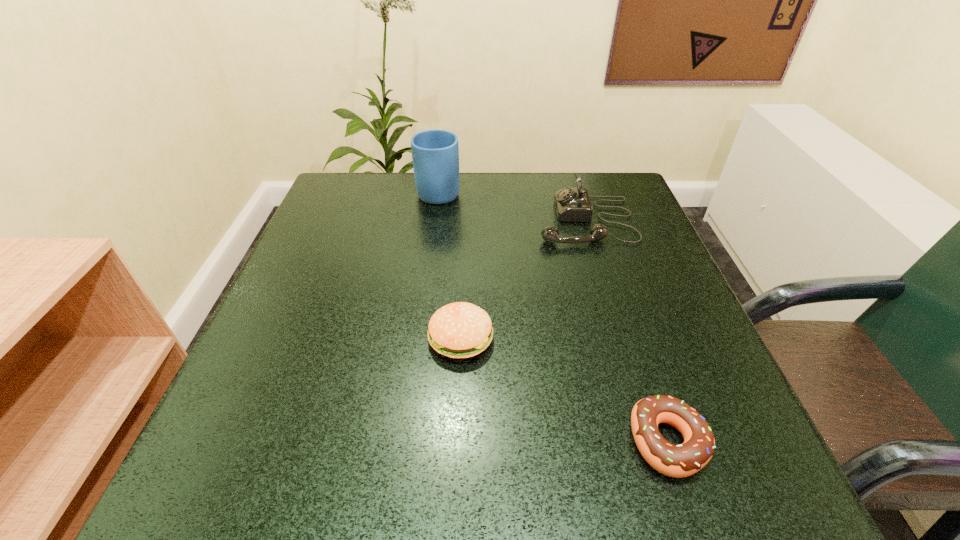
Find the location of a particular element. The height and width of the screenshot is (540, 960). blank region between the third farthest object and the telephone is located at coordinates (523, 280).

Where is `free space between the patty and the shortest object`? The height and width of the screenshot is (540, 960). free space between the patty and the shortest object is located at coordinates (564, 390).

This screenshot has width=960, height=540. Identify the location of vacant point located between the nearest object and the telephone. (627, 331).

I want to click on the second closest object to the nearest object, so click(x=572, y=204).

Locate an element on the screen. the second closest object to the second tallest object is located at coordinates (459, 330).

You are a GUI agent. You are given a task and a screenshot of the screen. Output one action in this format:
    pyautogui.click(x=<x>, y=<y>)
    Task: Click on the free space that satisfies the following two spatial constraints: 1. on the front side of the shortest object; 2. on the right side of the patty
    
    Given the screenshot: What is the action you would take?
    pyautogui.click(x=456, y=441)

This screenshot has width=960, height=540. I want to click on free location that satisfies the following two spatial constraints: 1. on the dial of the shortest object; 2. on the right side of the telephone, so click(x=653, y=441).